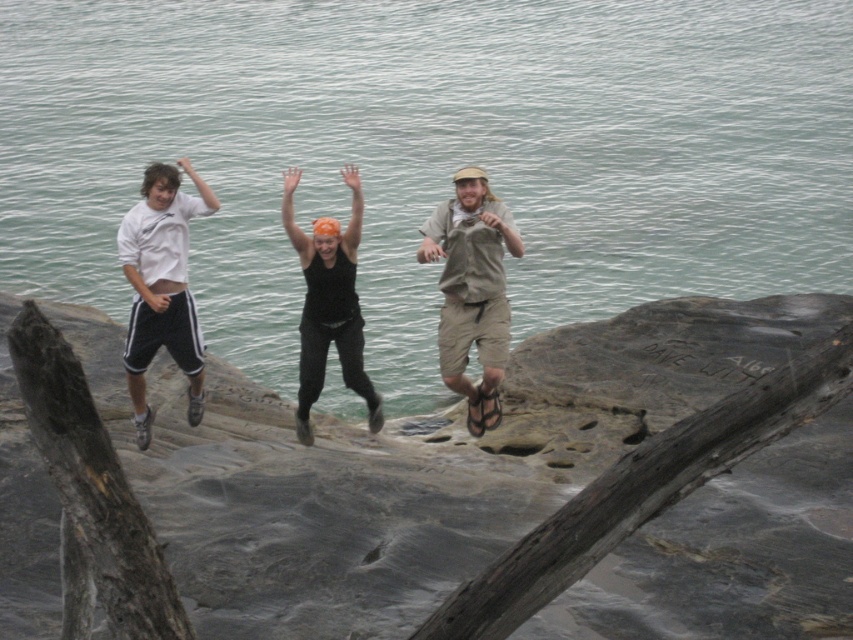
Which is in front, point (187, 10) or point (260, 522)?

Point (260, 522)

What do you see at coordinates (431, 154) in the screenshot? I see `clear water at center` at bounding box center [431, 154].

This screenshot has height=640, width=853. Describe the element at coordinates (431, 154) in the screenshot. I see `clear water at center` at that location.

Locate an element on the screen. Image resolution: width=853 pixels, height=640 pixels. clear water at center is located at coordinates (431, 154).

Can you confirm if clear water at center is shorter than khaki cotton shorts at center?

Incorrect, clear water at center's height does not fall short of khaki cotton shorts at center's.

Can you confirm if clear water at center is wider than khaki cotton shorts at center?

Yes, clear water at center is wider than khaki cotton shorts at center.

Locate an element on the screen. This screenshot has height=640, width=853. clear water at center is located at coordinates (431, 154).

Where is `clear water at center`? Image resolution: width=853 pixels, height=640 pixels. clear water at center is located at coordinates (431, 154).

In the scene shown: How much distance is there between gray rough rock at center and black fabric tank top at center?

gray rough rock at center is 4.75 meters away from black fabric tank top at center.

Does gray rough rock at center have a greater height compared to black fabric tank top at center?

In fact, gray rough rock at center may be shorter than black fabric tank top at center.

Between point (817, 525) and point (364, 397), which one is positioned behind?

The point (364, 397) is more distant.

You are a GUI agent. You are given a task and a screenshot of the screen. Output one action in this format:
    pyautogui.click(x=<x>, y=<y>)
    Task: Click on the gray rough rock at center
    The width and height of the screenshot is (853, 640).
    Given the screenshot: What is the action you would take?
    pyautogui.click(x=412, y=461)